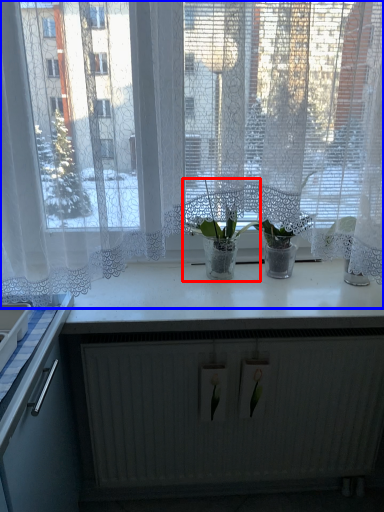
Question: Which of the following is the farthest to the observer, houseplant (highlighted by a red box) or window (highlighted by a blue box)?

Choices:
 (A) houseplant
 (B) window

Answer: (A)